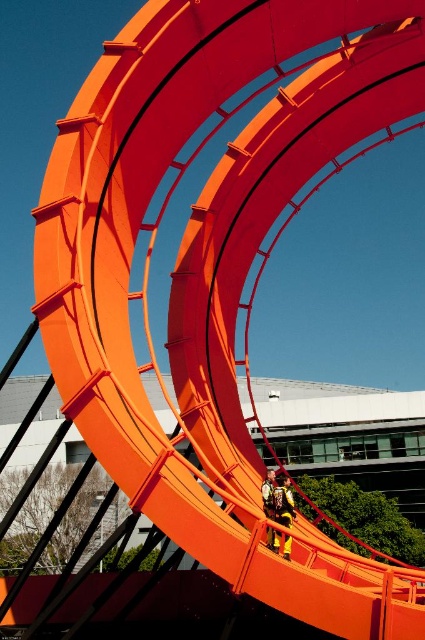
You are standing in front of the architectural sculpture and notice a point marked at coordinates (x=283, y=500). What color is the object located at this coordinate?

The point at coordinates (x=283, y=500) indicates a yellow fabric at center.

You are a maintenance worker standing on the orange ring and need to reach the yellow fabric at center. According to the coordinates provided, in which direction should you move relative to your current position?

The yellow fabric at center is located at point (283, 500), so you should move towards the center of the sculpture to reach it.